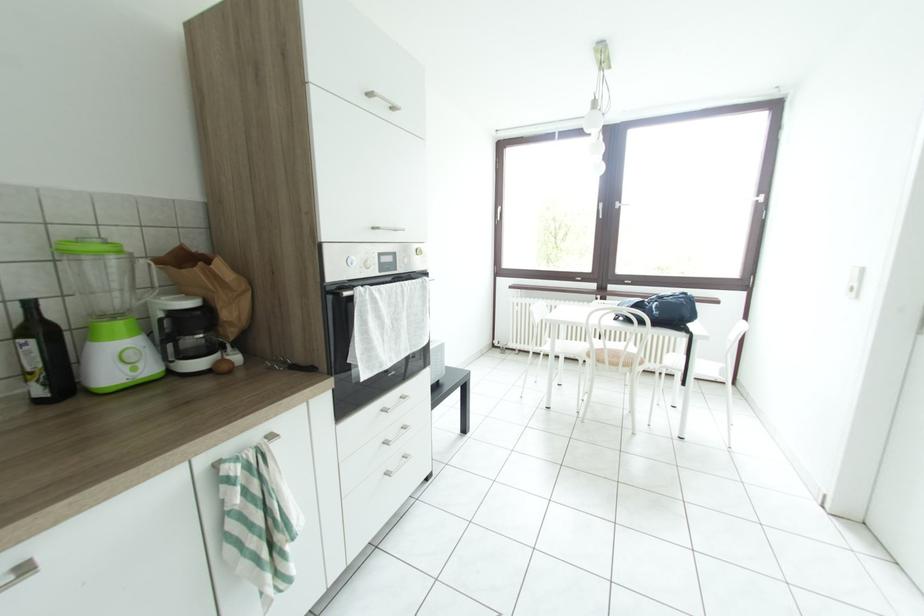
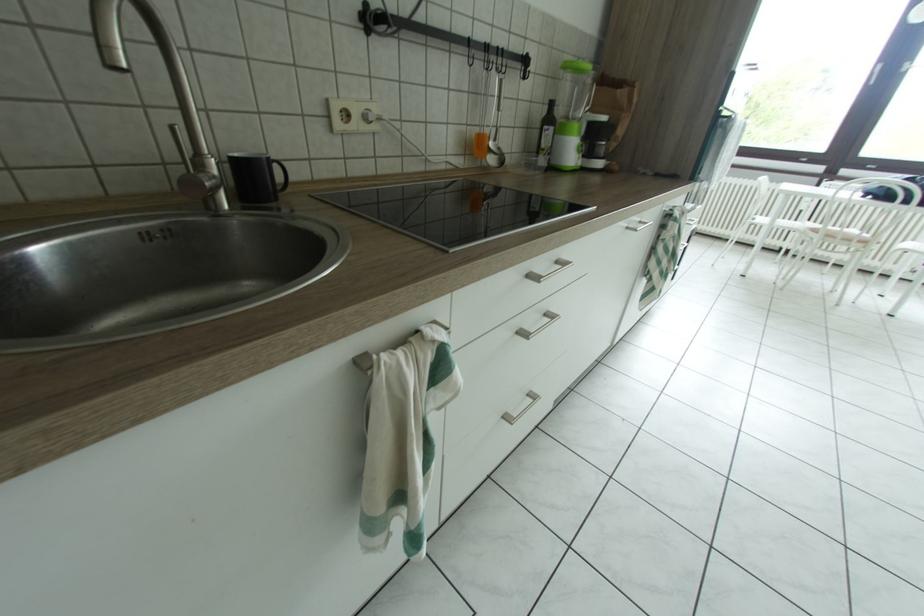
What movement of the cameraman would produce the second image?

The cameraman moved toward left, backward.